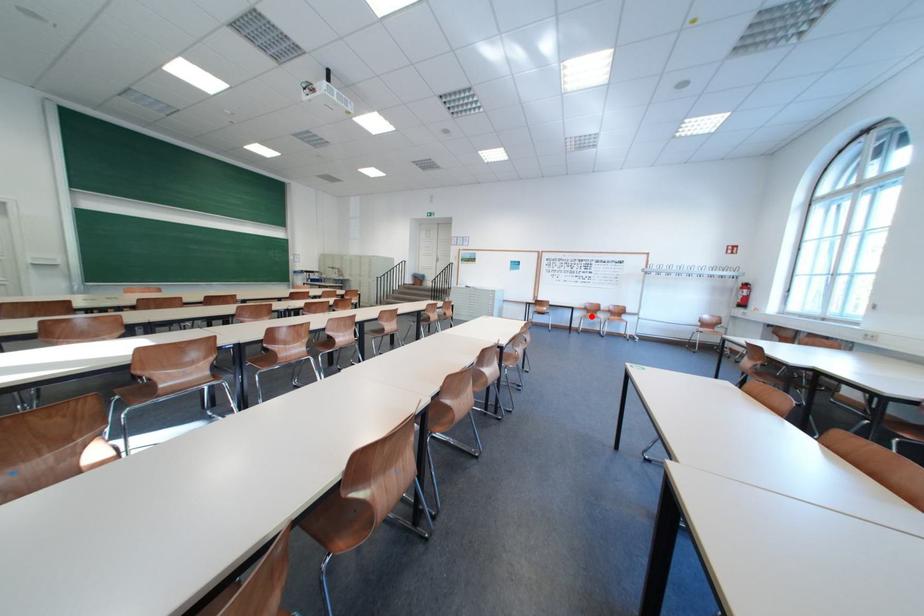
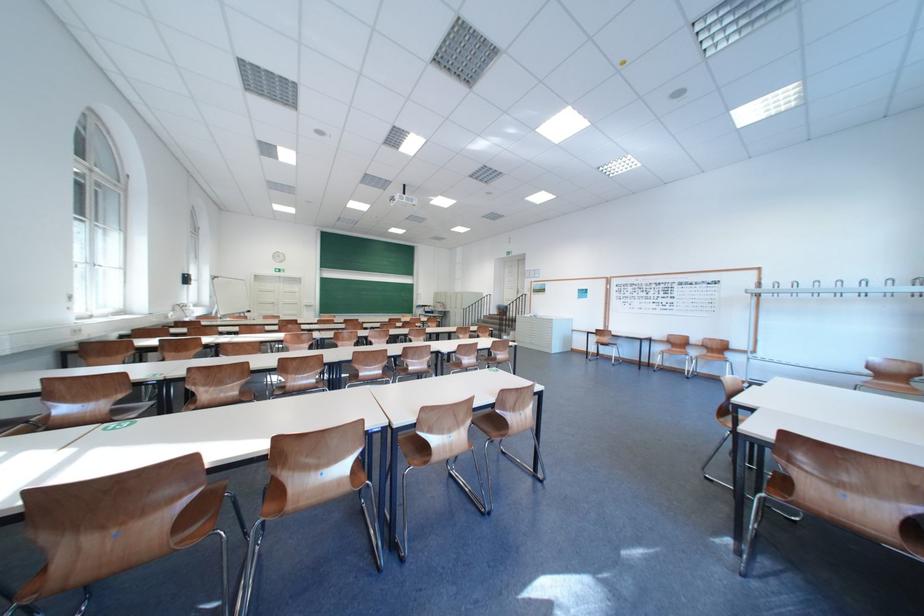
In the second image, find the point that corresponds to the highlighted location in the first image.

(673, 350)